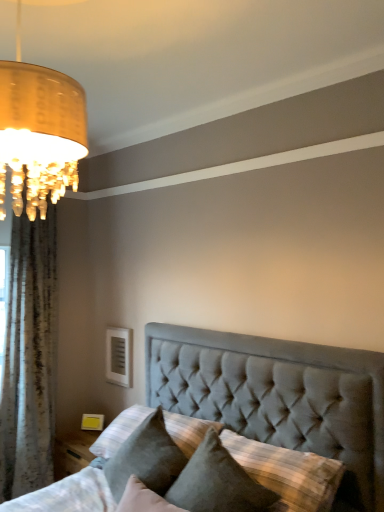
Question: Considering the relative positions of white textured curtain at left and velvet gray pillow at lower center, the 1th pillow when ordered from left to right, in the image provided, is white textured curtain at left in front of velvet gray pillow at lower center, the 1th pillow when ordered from left to right,?

Choices:
 (A) no
 (B) yes

Answer: (A)

Question: Is velvet gray pillow at lower center, the second pillow viewed from the right, a part of white textured curtain at left?

Choices:
 (A) yes
 (B) no

Answer: (B)

Question: Is white textured curtain at left smaller than velvet gray pillow at lower center, the second pillow viewed from the right?

Choices:
 (A) yes
 (B) no

Answer: (B)

Question: Does white textured curtain at left have a greater height compared to velvet gray pillow at lower center, the 1th pillow when ordered from left to right?

Choices:
 (A) yes
 (B) no

Answer: (A)

Question: Considering the relative sizes of white textured curtain at left and velvet gray pillow at lower center, the second pillow viewed from the right, in the image provided, is white textured curtain at left thinner than velvet gray pillow at lower center, the second pillow viewed from the right,?

Choices:
 (A) yes
 (B) no

Answer: (A)

Question: Is the depth of white textured curtain at left greater than that of velvet gray pillow at lower center, the second pillow viewed from the right?

Choices:
 (A) no
 (B) yes

Answer: (B)

Question: Can you confirm if velvet gray pillow at lower center, the second pillow viewed from the right, is shorter than white textured curtain at left?

Choices:
 (A) yes
 (B) no

Answer: (A)

Question: From a real-world perspective, is velvet gray pillow at lower center, the second pillow viewed from the right, over white textured curtain at left?

Choices:
 (A) no
 (B) yes

Answer: (A)

Question: Does velvet gray pillow at lower center, the second pillow viewed from the right, have a smaller size compared to white textured curtain at left?

Choices:
 (A) no
 (B) yes

Answer: (B)

Question: Is velvet gray pillow at lower center, the second pillow viewed from the right, oriented away from white textured curtain at left?

Choices:
 (A) yes
 (B) no

Answer: (B)

Question: From a real-world perspective, is velvet gray pillow at lower center, the 1th pillow when ordered from left to right, beneath white textured curtain at left?

Choices:
 (A) no
 (B) yes

Answer: (B)

Question: Is the depth of velvet gray pillow at lower center, the 1th pillow when ordered from left to right, less than that of white textured curtain at left?

Choices:
 (A) no
 (B) yes

Answer: (B)

Question: From a real-world perspective, does suede pillow at center, the 1th pillow in the right-to-left sequence, stand above velvet gray pillow at lower center, the 1th pillow when ordered from left to right?

Choices:
 (A) yes
 (B) no

Answer: (B)